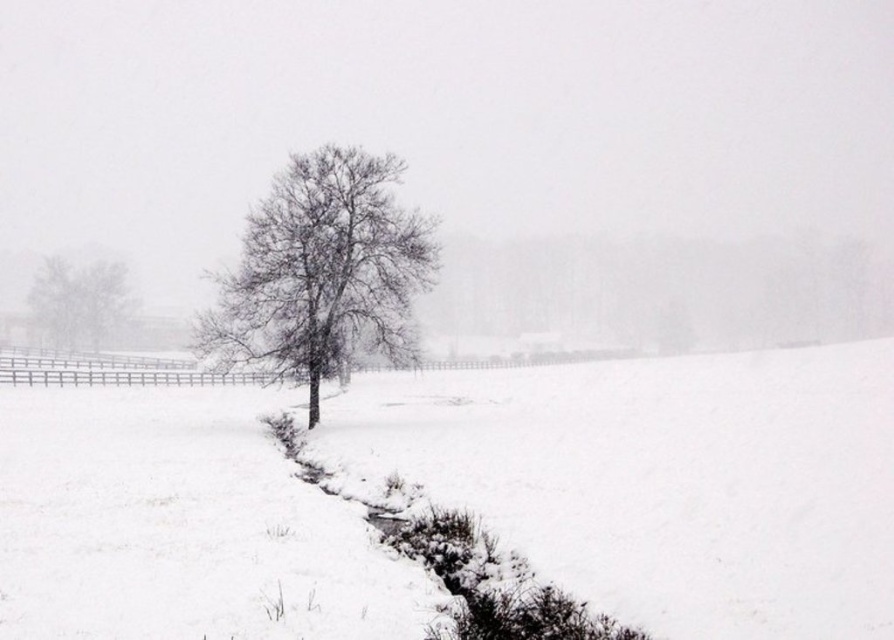
This screenshot has width=894, height=640. Describe the element at coordinates (322, 272) in the screenshot. I see `bare branches at center` at that location.

Does bare branches at center have a greater height compared to bare branches at left?

Correct, bare branches at center is much taller as bare branches at left.

Where is `bare branches at center`? This screenshot has width=894, height=640. bare branches at center is located at coordinates (322, 272).

Which is in front, point (384, 211) or point (508, 621)?

Positioned in front is point (508, 621).

The width and height of the screenshot is (894, 640). What do you see at coordinates (322, 272) in the screenshot?
I see `bare branches at center` at bounding box center [322, 272].

Identify the location of bare branches at center. Image resolution: width=894 pixels, height=640 pixels. (322, 272).

How distant is white fluffy snow at center from bare branches at center?

white fluffy snow at center is 13.74 meters away from bare branches at center.

Between white fluffy snow at center and bare branches at center, which one is positioned higher?

bare branches at center

What do you see at coordinates (663, 481) in the screenshot?
I see `white fluffy snow at center` at bounding box center [663, 481].

This screenshot has width=894, height=640. I want to click on white fluffy snow at center, so click(663, 481).